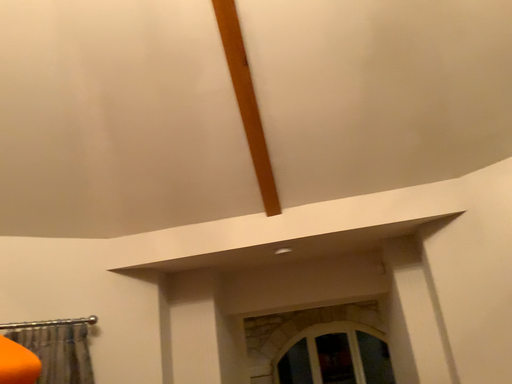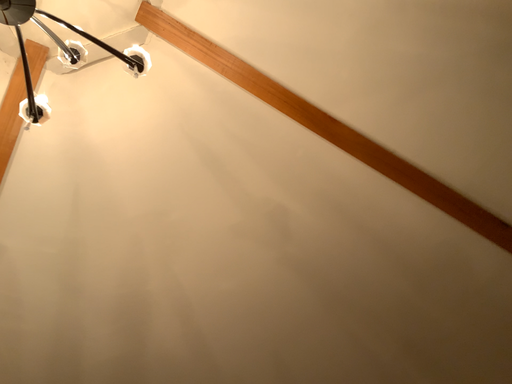
Question: How did the camera likely rotate when shooting the video?

Choices:
 (A) rotated left
 (B) rotated right

Answer: (A)